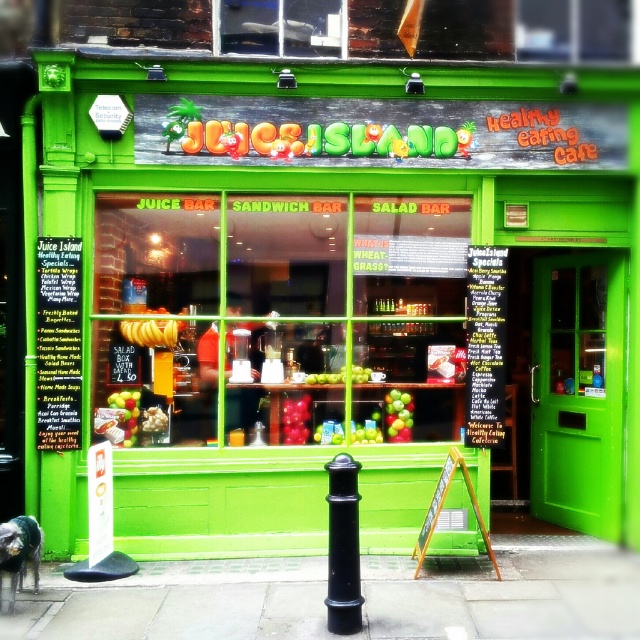
Between black polished metal pole at center and green matte apple at center, which one is positioned lower?

black polished metal pole at center is below.

The image size is (640, 640). Describe the element at coordinates (342, 547) in the screenshot. I see `black polished metal pole at center` at that location.

Locate an element on the screen. Image resolution: width=640 pixels, height=640 pixels. black polished metal pole at center is located at coordinates (342, 547).

Is paved concrete sidewalk at center positioned behind black polished metal pole at center?

Yes, it is behind black polished metal pole at center.

Between paved concrete sidewalk at center and black polished metal pole at center, which one appears on the right side from the viewer's perspective?

paved concrete sidewalk at center is more to the right.

Locate an element on the screen. The width and height of the screenshot is (640, 640). paved concrete sidewalk at center is located at coordinates (504, 595).

Does black polished metal pole at center have a lesser height compared to green matte bananas at left?

In fact, black polished metal pole at center may be taller than green matte bananas at left.

Does black polished metal pole at center appear on the right side of green matte bananas at left?

Yes, black polished metal pole at center is to the right of green matte bananas at left.

Does point (332, 570) come in front of point (134, 428)?

Yes, it is in front of point (134, 428).

Image resolution: width=640 pixels, height=640 pixels. What are the coordinates of `black polished metal pole at center` in the screenshot? It's located at (342, 547).